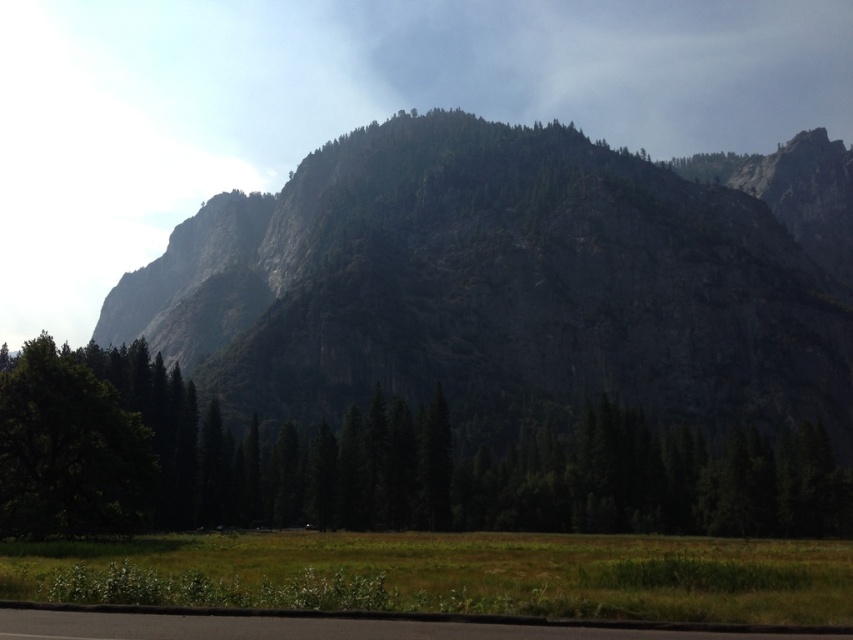
From the picture: Based on the scene description, can you determine which object is smaller in size between the granite rock formation at center and the transparent white cloud at upper center?

The granite rock formation at center is smaller in size compared to the transparent white cloud at upper center according to the description.

You are a hiker standing at the starting point of the black asphalt road at lower center. You want to reach the green matte tree at center. Which direction should you walk to get there?

The green matte tree at center is to the right of the black asphalt road at lower center, so you should walk to the right to reach it.

You are a hiker planning to hike from the transparent white cloud at upper center to the green matte tree at center. The trail is straight and you can walk 3 km per hour. How long will it take you to reach the tree?

The distance between the transparent white cloud at upper center and the green matte tree at center is 247.53 meters. At a walking speed of 3 km per hour, it would take approximately 5 minutes to reach the tree.